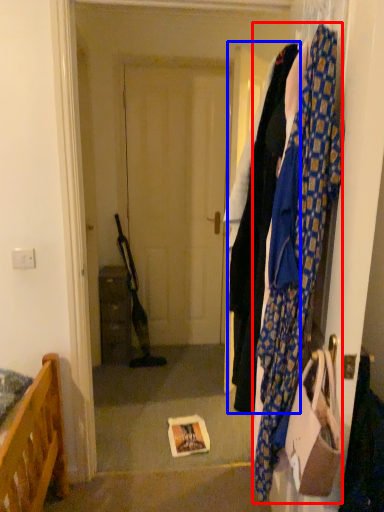
Question: Among these objects, which one is nearest to the camera, scarf (highlighted by a red box) or clothing (highlighted by a blue box)?

Choices:
 (A) scarf
 (B) clothing

Answer: (A)